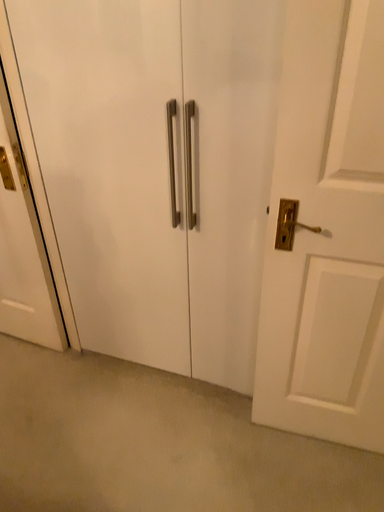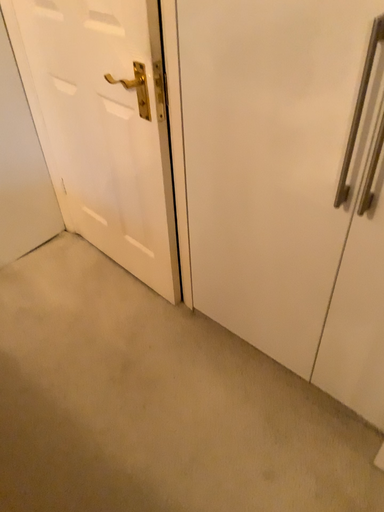
Question: Which way did the camera rotate in the video?

Choices:
 (A) rotated upward
 (B) rotated downward

Answer: (B)